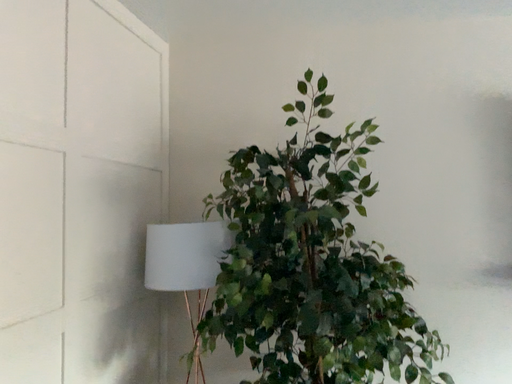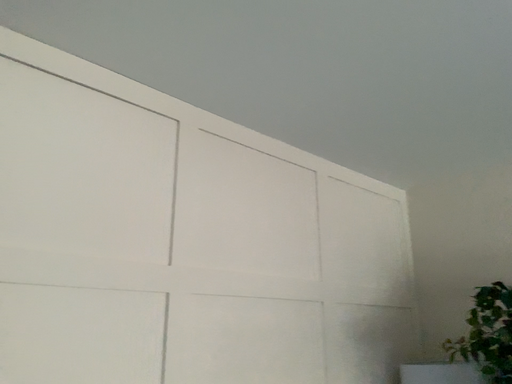
Question: Which way did the camera rotate in the video?

Choices:
 (A) rotated right
 (B) rotated left

Answer: (B)